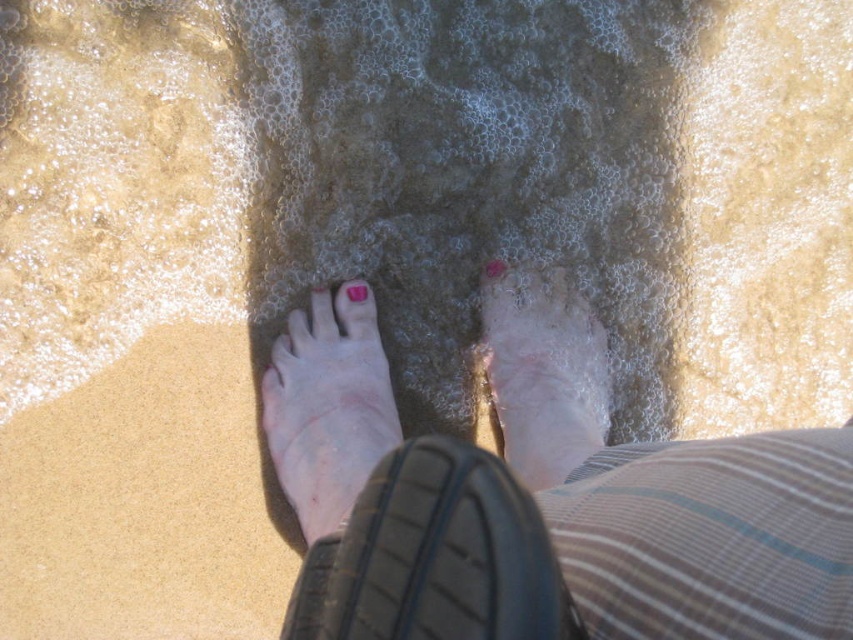
Question: Can you confirm if pale skin foot at center is wider than pink matte toe at center?

Choices:
 (A) yes
 (B) no

Answer: (A)

Question: Is pink painted toenails at center positioned before black rubber shoe at lower center?

Choices:
 (A) no
 (B) yes

Answer: (A)

Question: Estimate the real-world distances between objects in this image. Which object is farther from the pale skin foot at center?

Choices:
 (A) pink painted toenails at center
 (B) pink matte toe at center
 (C) black rubber shoe at lower center
 (D) pink matte nail polish at center

Answer: (C)

Question: Which of the following is the farthest from the observer?

Choices:
 (A) (584, 340)
 (B) (497, 262)

Answer: (A)

Question: From the image, what is the correct spatial relationship of pale skin foot at center in relation to pale skin at center?

Choices:
 (A) above
 (B) below

Answer: (B)

Question: Which object is the closest to the pink painted toenails at center?

Choices:
 (A) black rubber shoe at lower center
 (B) pink matte toe at center
 (C) pale skin foot at center
 (D) pale skin at center

Answer: (D)